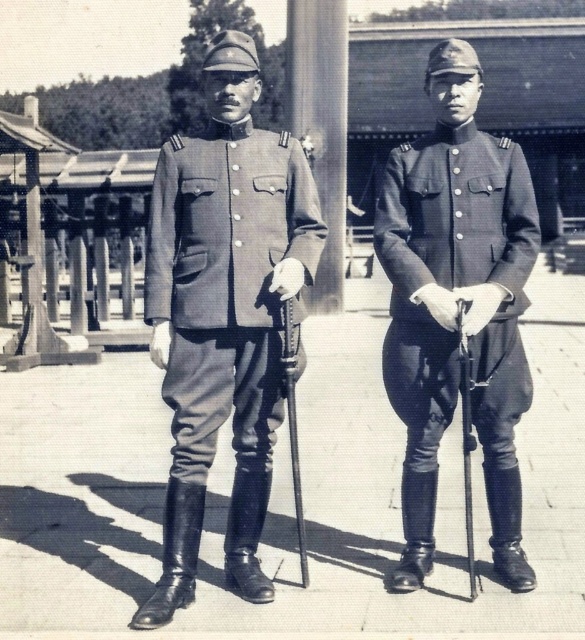
Does matte uniform at center appear on the right side of matte black uniform at center?

No, matte uniform at center is not to the right of matte black uniform at center.

The height and width of the screenshot is (640, 585). Find the location of `matte uniform at center`. matte uniform at center is located at coordinates (223, 314).